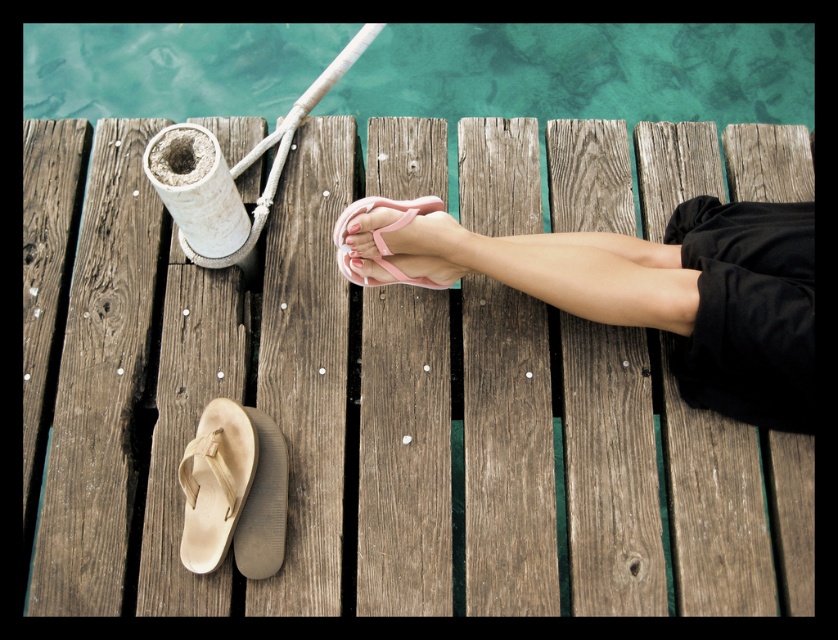
Question: Which point is closer to the camera?

Choices:
 (A) tan leather sandal at lower left
 (B) pink rubber sandal at center
 (C) wooden dock at center

Answer: (A)

Question: Which of the following is the farthest from the observer?

Choices:
 (A) (542, 67)
 (B) (402, 202)
 (C) (241, 529)
 (D) (379, 276)

Answer: (A)

Question: Does clear blue water at upper center appear over tan leather sandal at lower left?

Choices:
 (A) no
 (B) yes

Answer: (B)

Question: Considering the relative positions of pink rubber flip-flop at center and pink rubber sandal at center in the image provided, where is pink rubber flip-flop at center located with respect to pink rubber sandal at center?

Choices:
 (A) right
 (B) left

Answer: (A)

Question: Does clear blue water at upper center appear on the right side of tan leather sandal at lower left?

Choices:
 (A) yes
 (B) no

Answer: (A)

Question: Which of the following is the closest to the observer?

Choices:
 (A) (101, 252)
 (B) (761, 413)
 (C) (50, 76)

Answer: (B)